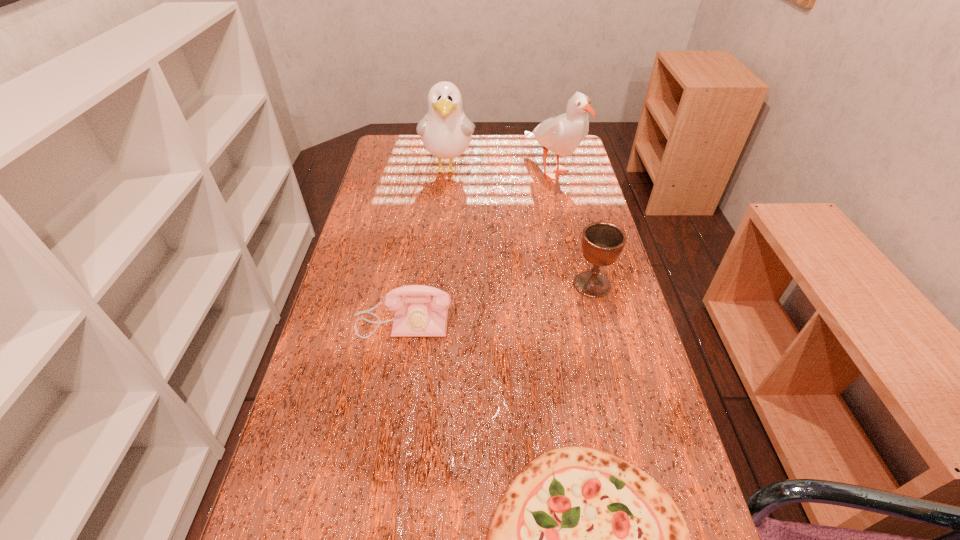
You are a GUI agent. You are given a task and a screenshot of the screen. Output one action in this format:
    pyautogui.click(x=<x>, y=<y>)
    Task: Click on the right gull
    This screenshot has height=540, width=960.
    Given the screenshot: What is the action you would take?
    pyautogui.click(x=562, y=134)

You are a GUI agent. You are given a task and a screenshot of the screen. Output one action in this format:
    pyautogui.click(x=<x>, y=<y>)
    Task: Click on the left gull
    The height and width of the screenshot is (540, 960).
    Given the screenshot: What is the action you would take?
    pyautogui.click(x=446, y=132)

Locate an element on the screen. Image resolution: width=960 pixels, height=540 pixels. the third nearest object is located at coordinates (602, 242).

Identify the location of chalice. (602, 242).

At what (x,y) coordinates should I click in order to perform the action: click on telephone. Please return your answer as a coordinate pair (x, y). Looking at the image, I should click on tap(420, 310).

Locate an element on the screen. the second nearest object is located at coordinates (420, 310).

Identify the location of free region located at the beak of the right gull. (562, 212).

Locate an element on the screen. This screenshot has height=540, width=960. free space located 0.260m on the beak of the left gull is located at coordinates (442, 237).

Where is `vacant area located 0.200m on the left of the chalice`? The height and width of the screenshot is (540, 960). vacant area located 0.200m on the left of the chalice is located at coordinates (497, 285).

Identify the location of free region located on the dial of the fourth farthest object. (383, 450).